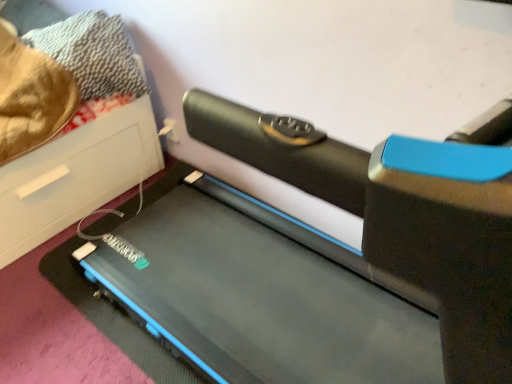
Question: Are black rubber treadmill at lower left and black rubber treadmill at center beside each other?

Choices:
 (A) yes
 (B) no

Answer: (B)

Question: Considering the relative sizes of black rubber treadmill at lower left and black rubber treadmill at center in the image provided, is black rubber treadmill at lower left wider than black rubber treadmill at center?

Choices:
 (A) no
 (B) yes

Answer: (B)

Question: Considering the relative positions of black rubber treadmill at lower left and black rubber treadmill at center in the image provided, is black rubber treadmill at lower left to the right of black rubber treadmill at center from the viewer's perspective?

Choices:
 (A) yes
 (B) no

Answer: (B)

Question: From the image's perspective, is black rubber treadmill at lower left on top of black rubber treadmill at center?

Choices:
 (A) no
 (B) yes

Answer: (B)

Question: From a real-world perspective, is black rubber treadmill at lower left positioned under black rubber treadmill at center based on gravity?

Choices:
 (A) yes
 (B) no

Answer: (A)

Question: Is black rubber treadmill at lower left positioned behind black rubber treadmill at center?

Choices:
 (A) yes
 (B) no

Answer: (A)

Question: Does black rubber treadmill at center have a smaller size compared to black rubber treadmill at lower left?

Choices:
 (A) yes
 (B) no

Answer: (B)

Question: Is black rubber treadmill at center wider than black rubber treadmill at lower left?

Choices:
 (A) yes
 (B) no

Answer: (B)

Question: From a real-world perspective, is black rubber treadmill at center positioned over black rubber treadmill at lower left based on gravity?

Choices:
 (A) yes
 (B) no

Answer: (A)

Question: Is black rubber treadmill at center in contact with black rubber treadmill at lower left?

Choices:
 (A) no
 (B) yes

Answer: (A)

Question: From the image's perspective, is black rubber treadmill at center below black rubber treadmill at lower left?

Choices:
 (A) yes
 (B) no

Answer: (A)

Question: Considering the relative sizes of black rubber treadmill at center and black rubber treadmill at lower left in the image provided, is black rubber treadmill at center taller than black rubber treadmill at lower left?

Choices:
 (A) no
 (B) yes

Answer: (B)

Question: Based on their sizes in the image, would you say black rubber treadmill at lower left is bigger or smaller than black rubber treadmill at center?

Choices:
 (A) small
 (B) big

Answer: (A)